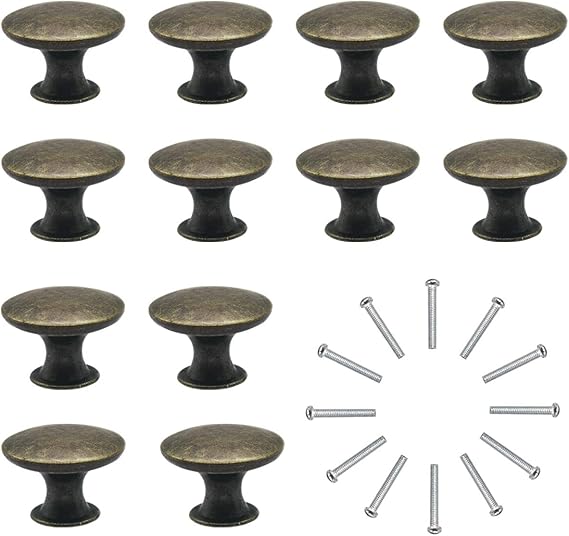
The height and width of the screenshot is (536, 569). What are the coordinates of `12 knobs` in the screenshot? It's located at (222, 324).